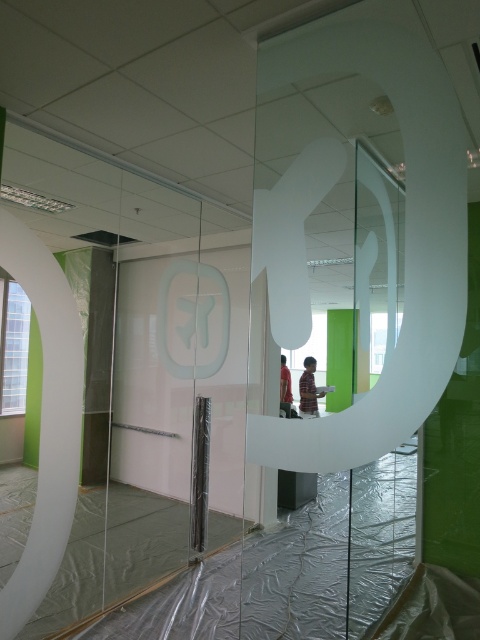
Question: Does white frosted glass logo at center come in front of striped shirt at center?

Choices:
 (A) no
 (B) yes

Answer: (B)

Question: Can you confirm if white frosted glass logo at center is smaller than striped shirt at center?

Choices:
 (A) no
 (B) yes

Answer: (B)

Question: Which object appears closest to the camera in this image?

Choices:
 (A) striped shirt at center
 (B) matte black shirt at center

Answer: (B)

Question: Can you confirm if white frosted glass logo at center is wider than matte black shirt at center?

Choices:
 (A) yes
 (B) no

Answer: (A)

Question: Which point is closer to the camera?

Choices:
 (A) striped shirt at center
 (B) white frosted glass logo at center
 (C) matte black shirt at center

Answer: (B)

Question: Which of these objects is positioned farthest from the white frosted glass logo at center?

Choices:
 (A) striped shirt at center
 (B) matte black shirt at center

Answer: (A)